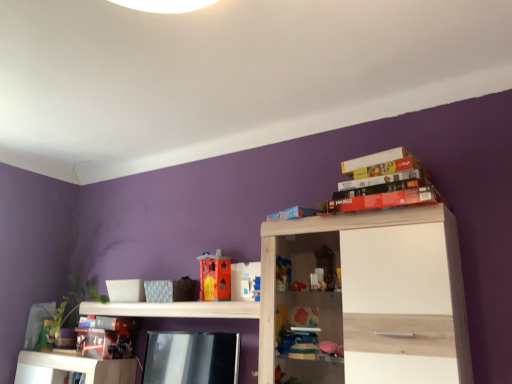
Image resolution: width=512 pixels, height=384 pixels. I want to click on vacant area that is in front of plastic toy castle at center, the 2th toy in the front-to-back sequence, so click(214, 301).